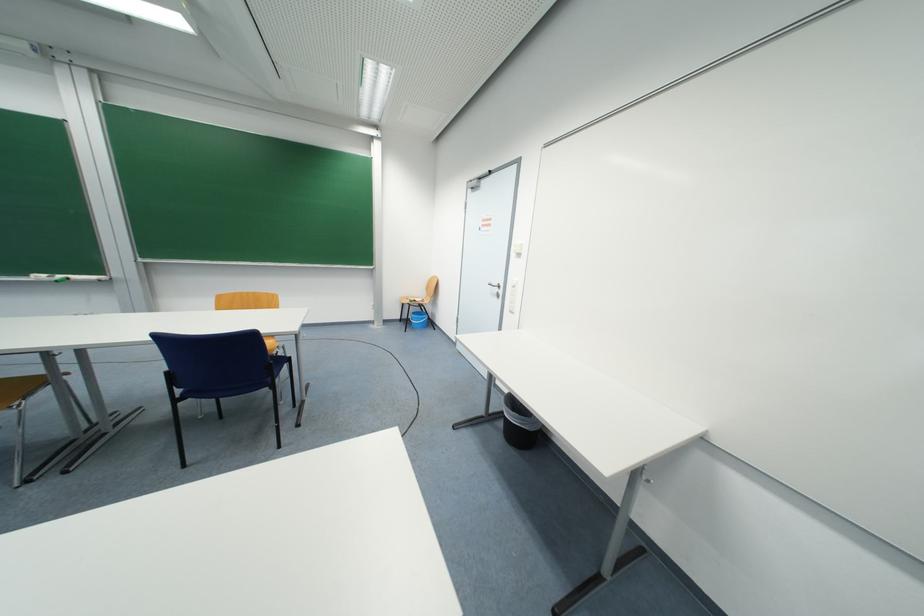
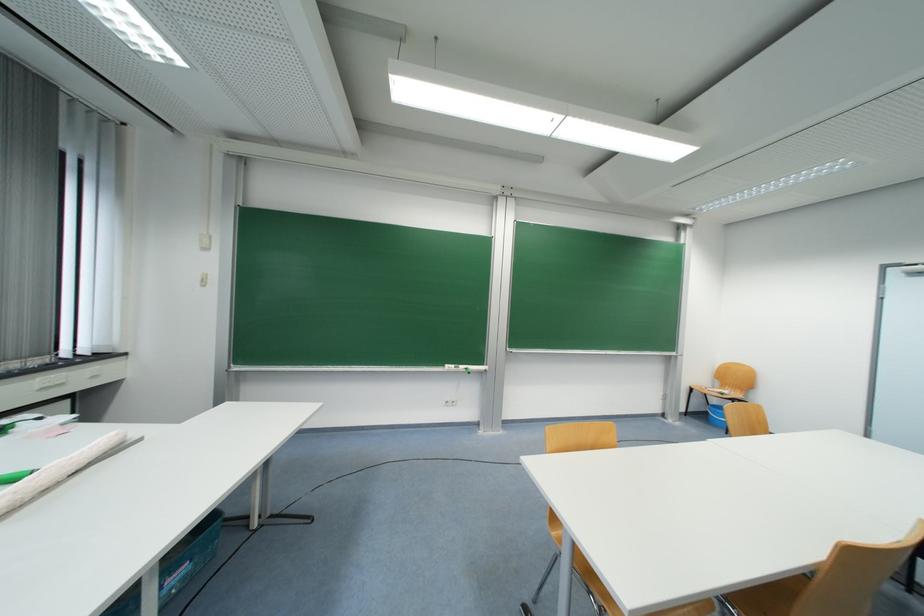
Question: Which direction would the cameraman need to move to produce the second image? Reply with the corresponding letter.

Choices:
 (A) Left
 (B) Right
 (C) Forward
 (D) Backward

Answer: (A)